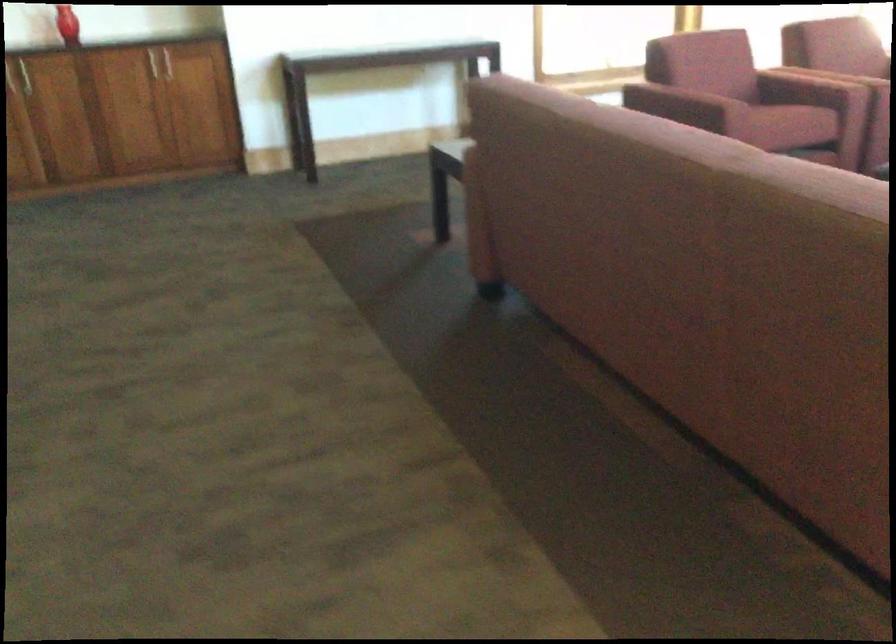
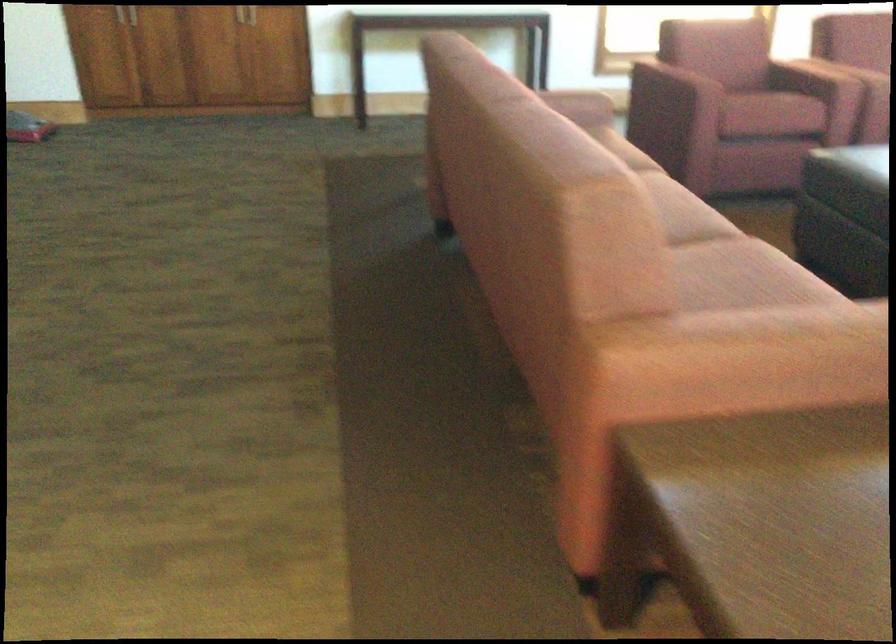
Question: The camera is either moving clockwise (left) or counter-clockwise (right) around the object. The first image is from the beginning of the video and the second image is from the end. Is the camera moving left or right when shooting the video?

Choices:
 (A) Left
 (B) Right

Answer: (B)